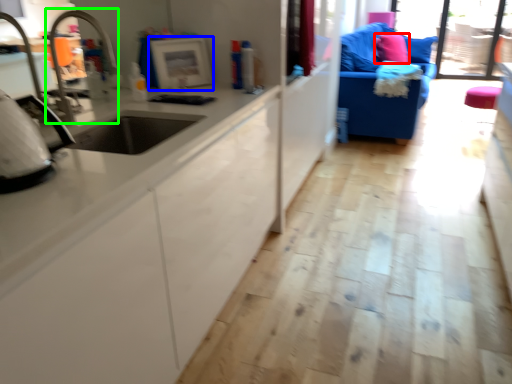
Question: Considering the real-world distances, which object is farthest from pillow (highlighted by a red box)? appliance (highlighted by a blue box) or faucet (highlighted by a green box)?

Choices:
 (A) appliance
 (B) faucet

Answer: (B)